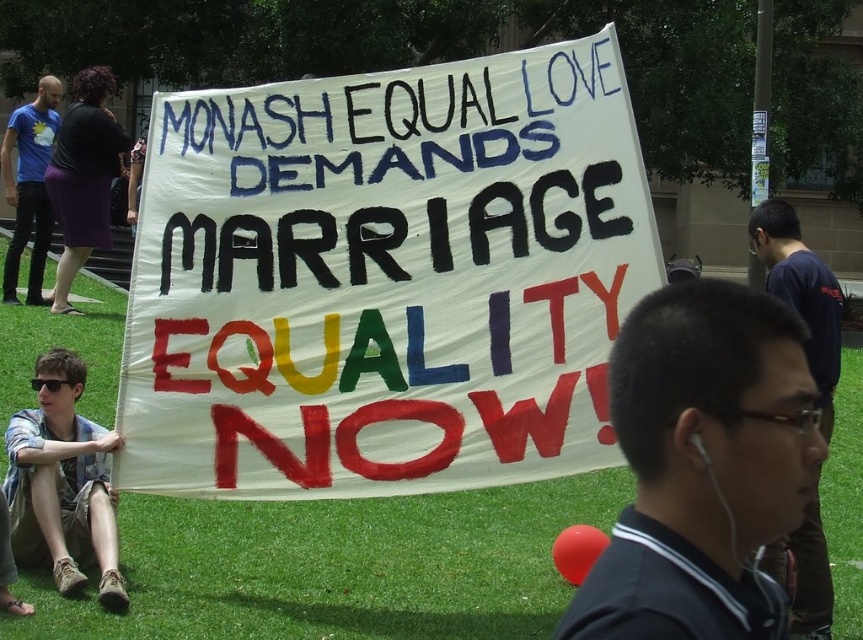
You are a photographer trying to capture the protest scene. You want to ensure both the white paper sign at center and the black fabric shirt at center are clearly visible in your photo. Considering their sizes, which object should you focus on to ensure both are in frame?

The white paper sign at center is larger in size than the black fabric shirt at center. To ensure both are in frame, focus on the larger object, the white paper sign at center, as it will require more space and positioning, thereby naturally including the smaller black fabric shirt at center within the shot.

Based on the photo, you are a photographer standing at the edge of the protest area. You want to take a photo that includes both the white paper sign at center and the green grass at center. Given that your camera has a maximum focus range of 7 meters, will you be able to capture both objects in focus without moving your position?

The white paper sign at center and green grass at center are 7.41 meters apart from each other. Since the distance between them exceeds the camera maximum focus range of 7 meters, you will not be able to capture both objects in focus without moving your position.

You are a photographer standing at the center of the grassy area where the protest is happening. You want to take a photo of the banner so that both points, point (260, 444) and point (452, 577), are clearly visible. Which point should you focus on first to ensure the banner is in sharp focus?

You should focus on point (260, 444) first because it is closer to you than point (452, 577). Since it is in front, focusing on it will ensure the banner is sharp.